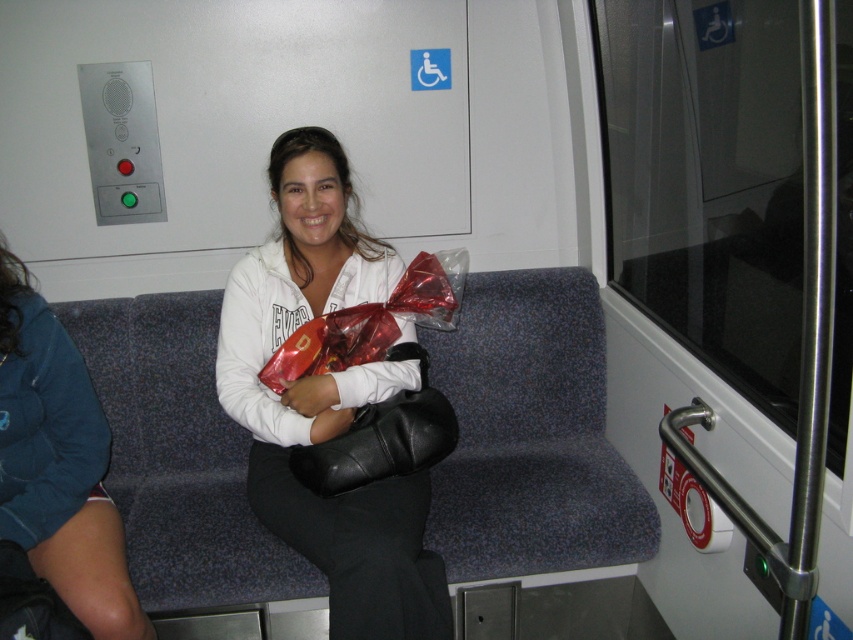
You are a photographer who needs to capture both the white matte jacket at center and the matte white hoodie at center in a single shot. Since the jacket is taller than the hoodie, which object should you focus on first to ensure both are in frame?

The white matte jacket at center is taller than the matte white hoodie at center. To ensure both are in frame, focus on the white matte jacket at center first as it requires more vertical space.

You are a passenger on a train and want to take a photo of the matte white hoodie at center. Where should you position your camera to capture it best?

The matte white hoodie at center is located at the coordinates 0.727 on the x axis and 0.069 on the y axis, so position your camera to aim at that point for the best capture.